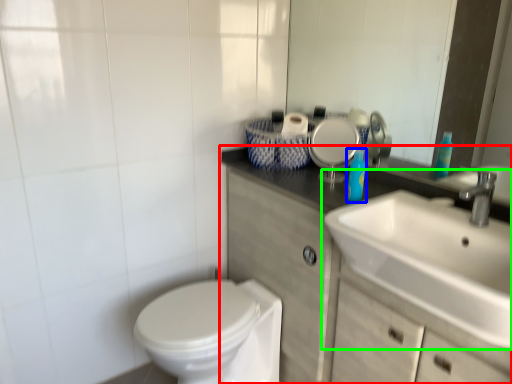
Question: Which object is positioned closest to bathroom cabinet (highlighted by a red box)? Select from toiletry (highlighted by a blue box) and sink (highlighted by a green box).

Choices:
 (A) toiletry
 (B) sink

Answer: (B)